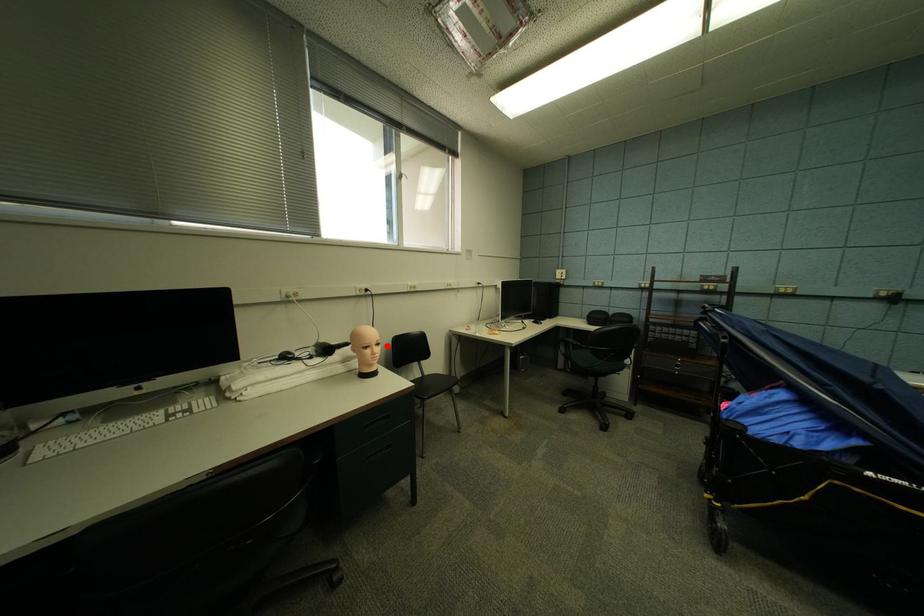
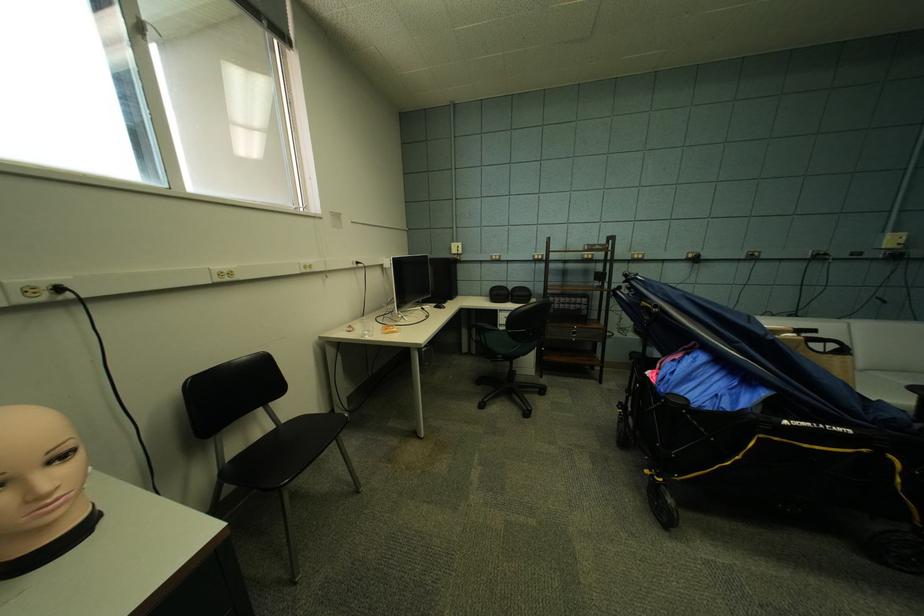
Locate, in the second image, the point that corresponds to the highlighted location in the first image.

(70, 459)